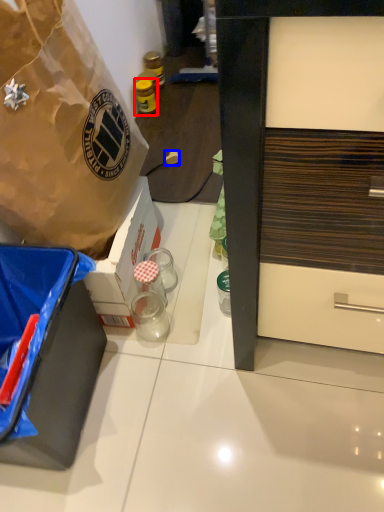
Question: Which of the following is the farthest to the observer, bottle (highlighted by a red box) or power outlet (highlighted by a blue box)?

Choices:
 (A) bottle
 (B) power outlet

Answer: (A)